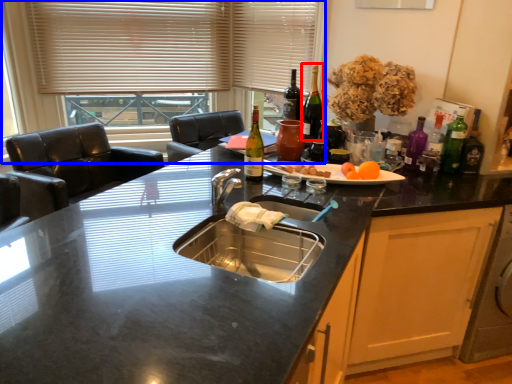
Question: Which object is closer to the camera taking this photo, wine bottle (highlighted by a red box) or window (highlighted by a blue box)?

Choices:
 (A) wine bottle
 (B) window

Answer: (A)